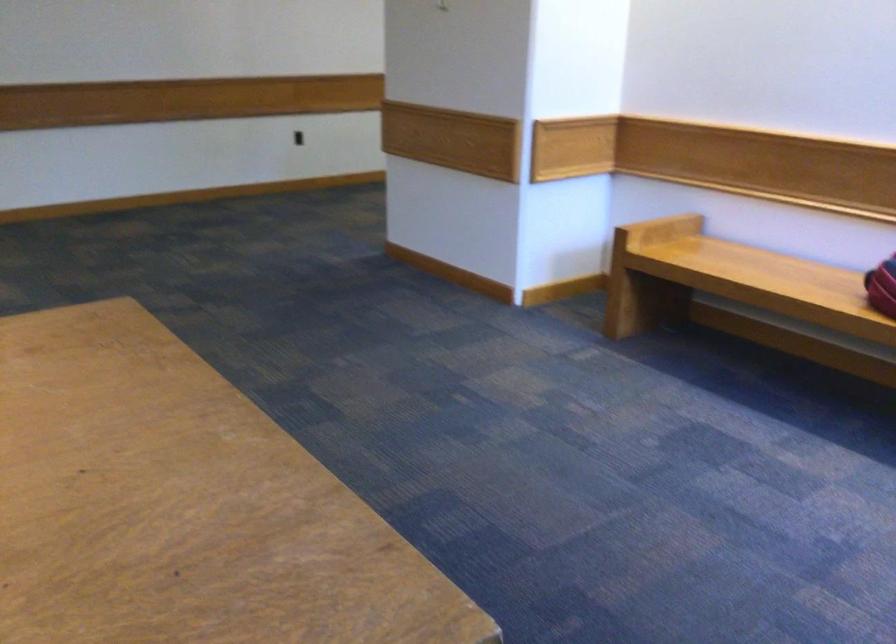
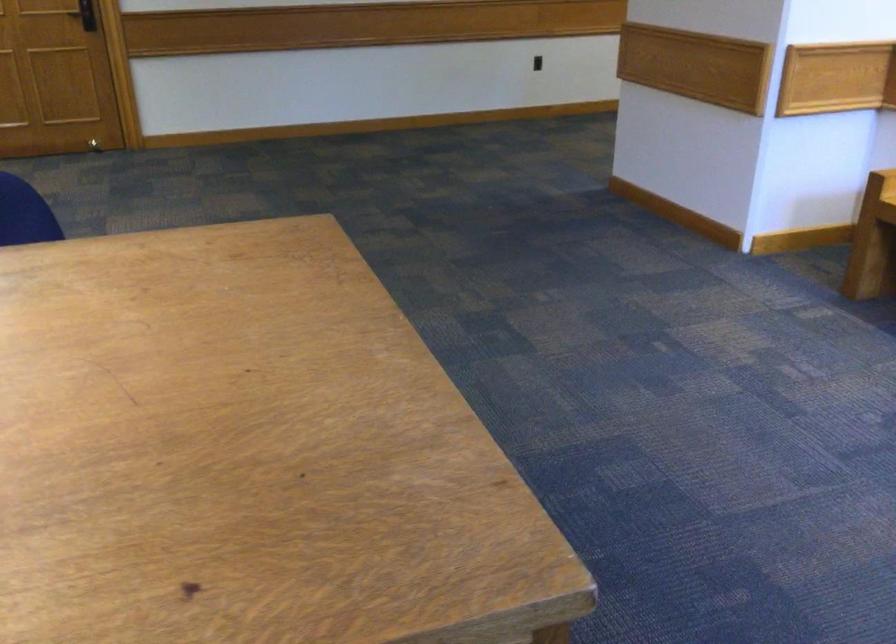
Locate, in the second image, the point that corresponds to point (298, 281) in the first image.

(515, 214)